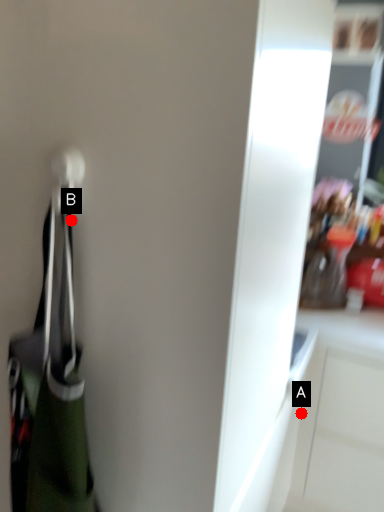
Question: Two points are circled on the image, labeled by A and B beside each circle. Which point is closer to the camera?

Choices:
 (A) A is closer
 (B) B is closer

Answer: (B)